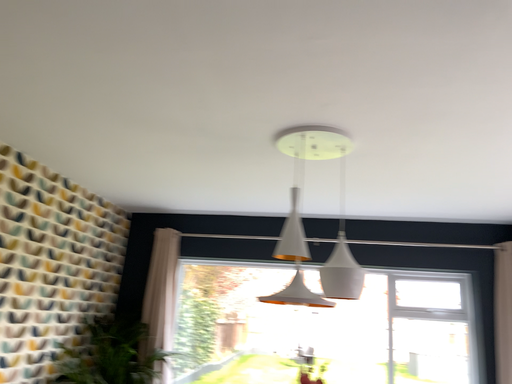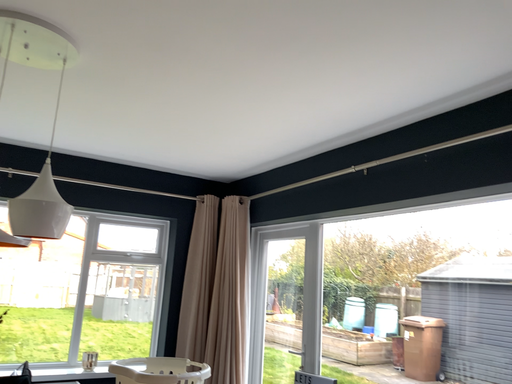
Question: How did the camera likely rotate when shooting the video?

Choices:
 (A) rotated left
 (B) rotated right

Answer: (B)